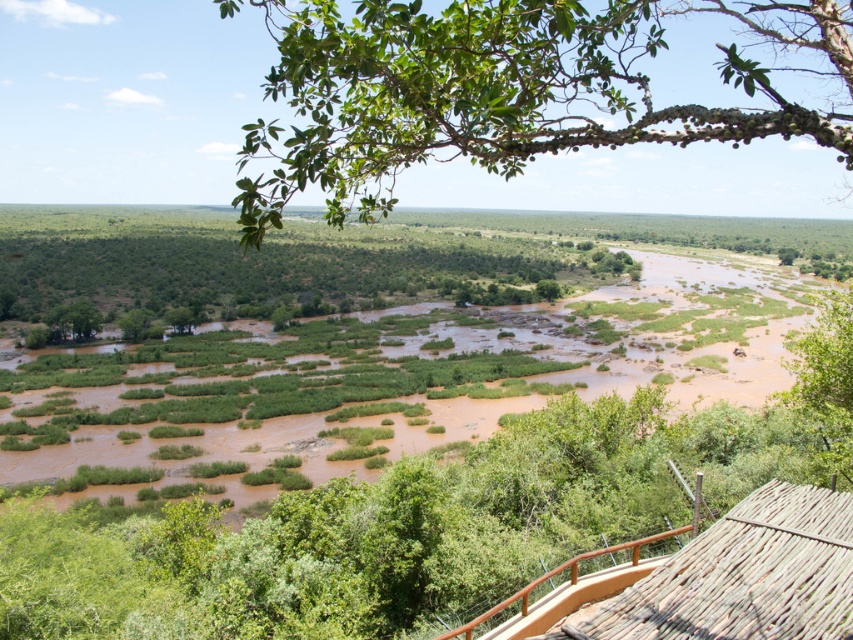
You are an architect designing a new ecofriendly viewing platform. You need to ensure that the green leafy branch at upper center and the brown wood railing at lower right do not block each other. Based on their widths, which one is wider?

The green leafy branch at upper center might be wider than brown wood railing at lower right, so the green leafy branch at upper center is likely wider and could potentially block the view of the brown wood railing at lower right if not positioned carefully.